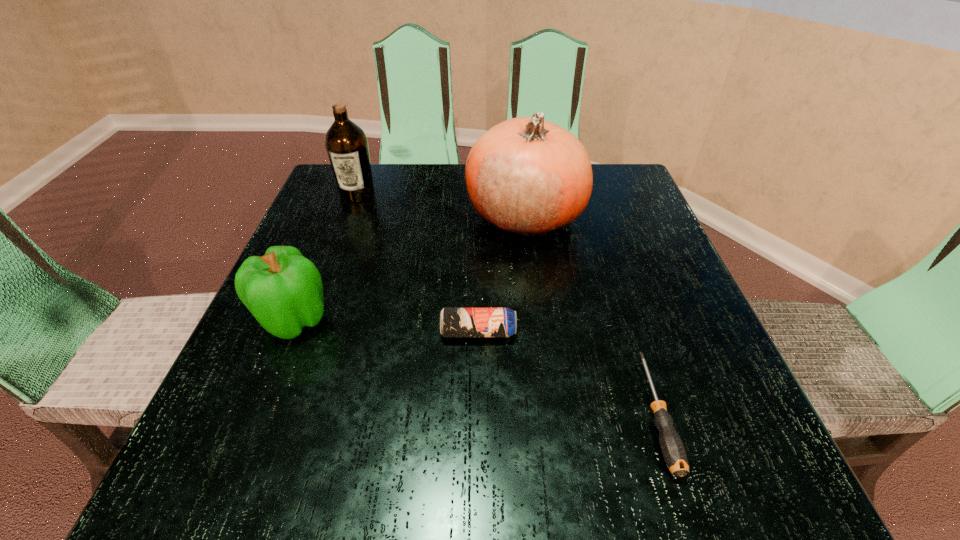
Image resolution: width=960 pixels, height=540 pixels. I want to click on object that is at the near right corner, so click(672, 448).

Locate an element on the screen. vacant area at the far edge of the desktop is located at coordinates (441, 216).

Where is `blank space at the near edge of the desktop`? The height and width of the screenshot is (540, 960). blank space at the near edge of the desktop is located at coordinates click(613, 467).

Locate an element on the screen. The width and height of the screenshot is (960, 540). free space at the left edge of the desktop is located at coordinates (235, 356).

This screenshot has width=960, height=540. Find the location of `free space at the right edge of the desktop`. free space at the right edge of the desktop is located at coordinates (654, 341).

In the image, there is a desktop. What are the coordinates of `vacant space at the far left corner` in the screenshot? It's located at 342,214.

Where is `vacant space at the far right corner of the desktop`? vacant space at the far right corner of the desktop is located at coordinates (632, 202).

At what (x,y) coordinates should I click in order to perform the action: click on vacant space that's between the beer can and the olive oil. Please return your answer as a coordinate pair (x, y). The width and height of the screenshot is (960, 540). Looking at the image, I should click on (418, 263).

The height and width of the screenshot is (540, 960). Identify the location of free space between the nearest object and the third tallest object. (475, 366).

This screenshot has width=960, height=540. I want to click on blank region between the olive oil and the pumpkin, so click(x=441, y=204).